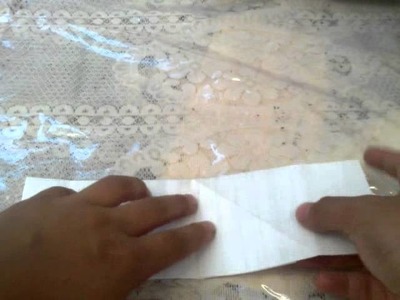
At what (x,y) coordinates should I click in order to perform the action: click on plastic table covering. Please return your answer as a coordinate pair (x, y). Looking at the image, I should click on (254, 91).